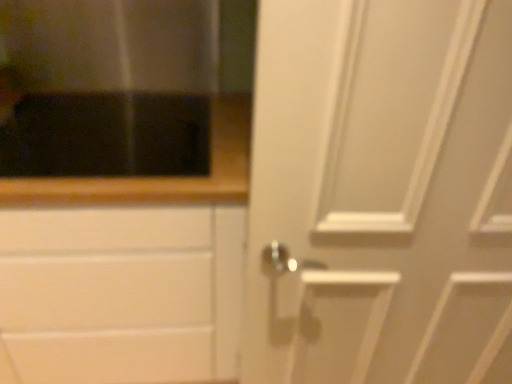
The height and width of the screenshot is (384, 512). Describe the element at coordinates (111, 45) in the screenshot. I see `matte glass mirror at upper left` at that location.

Measure the distance between matte glass mirror at upper left and camera.

They are 3.34 feet apart.

Where is `matte glass mirror at upper left`? Image resolution: width=512 pixels, height=384 pixels. matte glass mirror at upper left is located at coordinates (111, 45).

The height and width of the screenshot is (384, 512). I want to click on matte glass mirror at upper left, so click(111, 45).